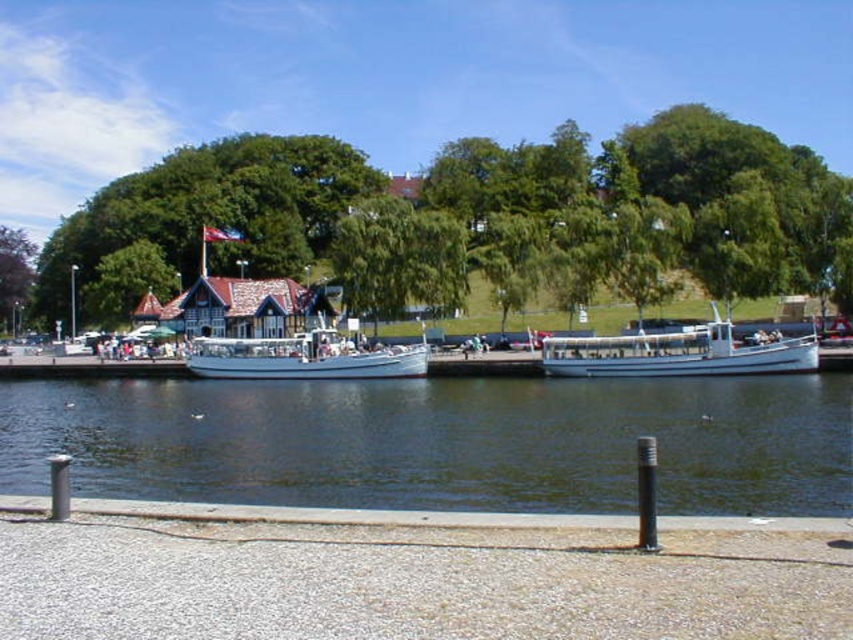
Between point (625, 371) and point (19, 273), which one is positioned in front?

Point (625, 371)

Which of these two, white matte boat at right or purple leafy tree at upper left, stands taller?

Standing taller between the two is purple leafy tree at upper left.

Is point (656, 348) in front of point (30, 257)?

Yes, it is.

Locate an element on the screen. Image resolution: width=853 pixels, height=640 pixels. white matte boat at right is located at coordinates (677, 353).

Between clear water at lower center and white matte boat at right, which one has more height?

With more height is white matte boat at right.

Measure the distance from clear water at lower center to white matte boat at right.

The distance of clear water at lower center from white matte boat at right is 39.17 feet.

Is point (265, 502) positioned behind point (808, 337)?

No, it is in front of (808, 337).

Image resolution: width=853 pixels, height=640 pixels. Identify the location of clear water at lower center. (440, 442).

Is green leafy tree at upper center to the right of white matte boat at center from the viewer's perspective?

Correct, you'll find green leafy tree at upper center to the right of white matte boat at center.

Which is behind, point (50, 253) or point (352, 355)?

The point (50, 253) is behind.

Who is more forward, [500,177] or [282,358]?

Point [282,358] is in front.

Locate an element on the screen. The image size is (853, 640). green leafy tree at upper center is located at coordinates (469, 220).